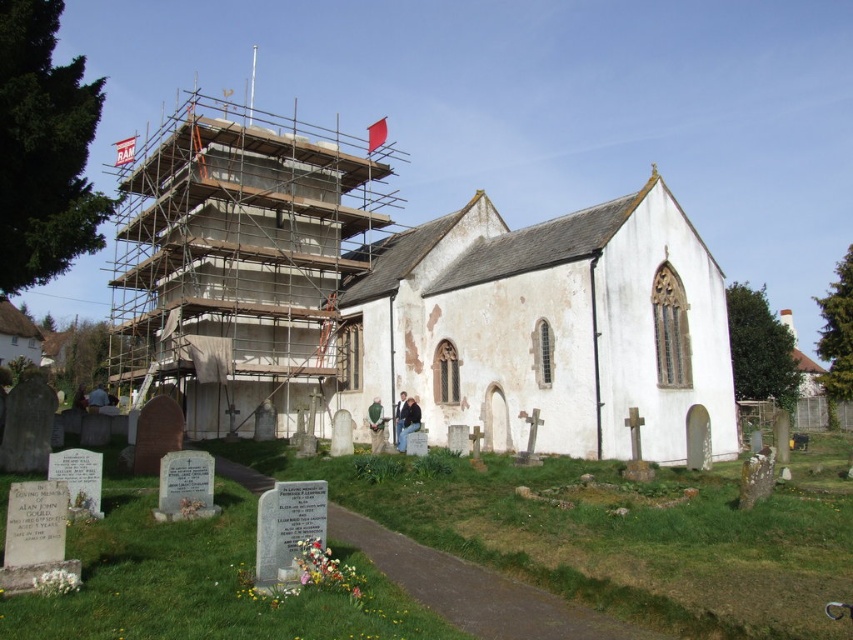
You are standing at the entrance of the graveyard and want to take a photo of the white stone chapel at center. Based on your current position, is the chapel positioned to your left, right, front, or behind you?

The white stone chapel at center is located at point coordinates which would be directly in front of you if you are facing the chapel from the entrance, so it is positioned in front.

You are a visitor standing in the graveyard looking towards the church. You notice both the white stone chapel at center and the concrete scaffolding at center. Which structure appears larger to you?

The white stone chapel at center is smaller than the concrete scaffolding at center, so the concrete scaffolding at center appears larger.

You are a visitor standing in front of the white stone chapel at center and the concrete scaffolding at center. Which object is closer to you?

The white stone chapel at center is closer to you because it is in front of the concrete scaffolding at center.